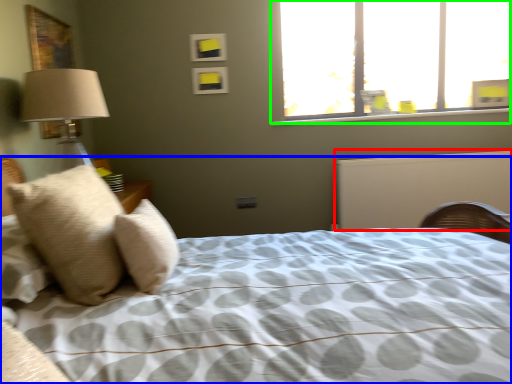
Question: Based on their relative distances, which object is farther from radiator (highlighted by a red box)? Choose from bed (highlighted by a blue box) and window (highlighted by a green box).

Choices:
 (A) bed
 (B) window

Answer: (A)